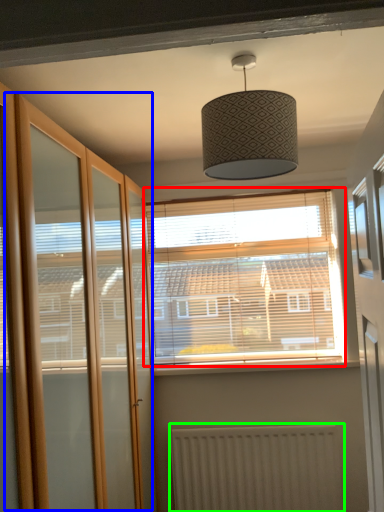
Question: Which object is positioned closest to window (highlighted by a red box)? Select from screen door (highlighted by a blue box) and radiator (highlighted by a green box).

Choices:
 (A) screen door
 (B) radiator

Answer: (B)